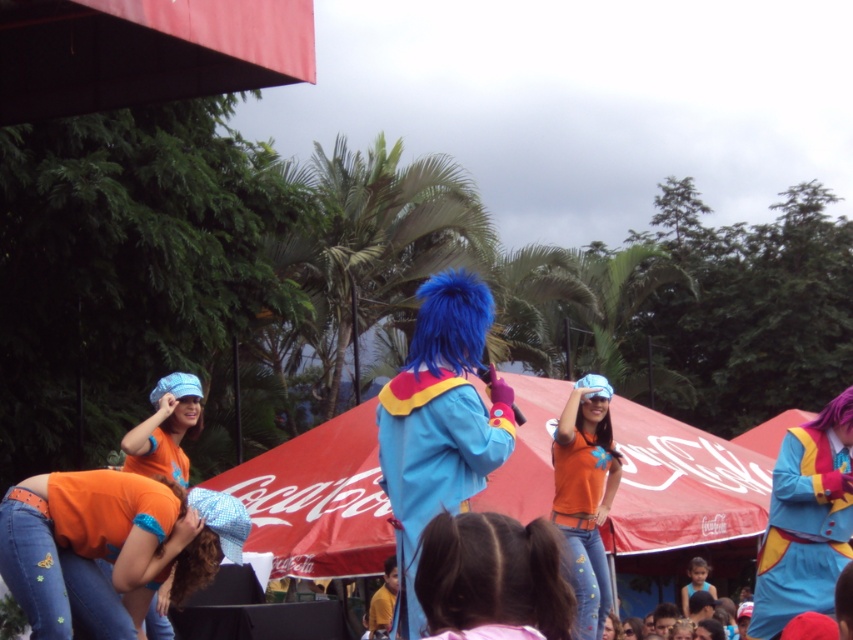
Does matte blue costume at center have a larger size compared to matte blue fabric hat at lower left?

Yes, matte blue costume at center is bigger than matte blue fabric hat at lower left.

Is matte blue costume at center thinner than matte blue fabric hat at lower left?

No, matte blue costume at center is not thinner than matte blue fabric hat at lower left.

Where is `matte blue costume at center`? The height and width of the screenshot is (640, 853). matte blue costume at center is located at coordinates (804, 528).

Can you confirm if blue fabric costume at center is shorter than smooth brown hair at center?

In fact, blue fabric costume at center may be taller than smooth brown hair at center.

Is point (380, 397) behind point (447, 515)?

Yes, it is behind point (447, 515).

Does point (456, 381) come closer to viewer compared to point (553, 595)?

No, (456, 381) is behind (553, 595).

The image size is (853, 640). Identify the location of blue fabric costume at center. (433, 461).

Which is above, smooth brown hair at center or matte blue fabric hat at lower left?

matte blue fabric hat at lower left is above.

Which of these two, smooth brown hair at center or matte blue fabric hat at lower left, stands taller?

With more height is smooth brown hair at center.

Is point (566, 600) farther from camera compared to point (154, 460)?

No.

The image size is (853, 640). What are the coordinates of `smooth brown hair at center` in the screenshot? It's located at (492, 576).